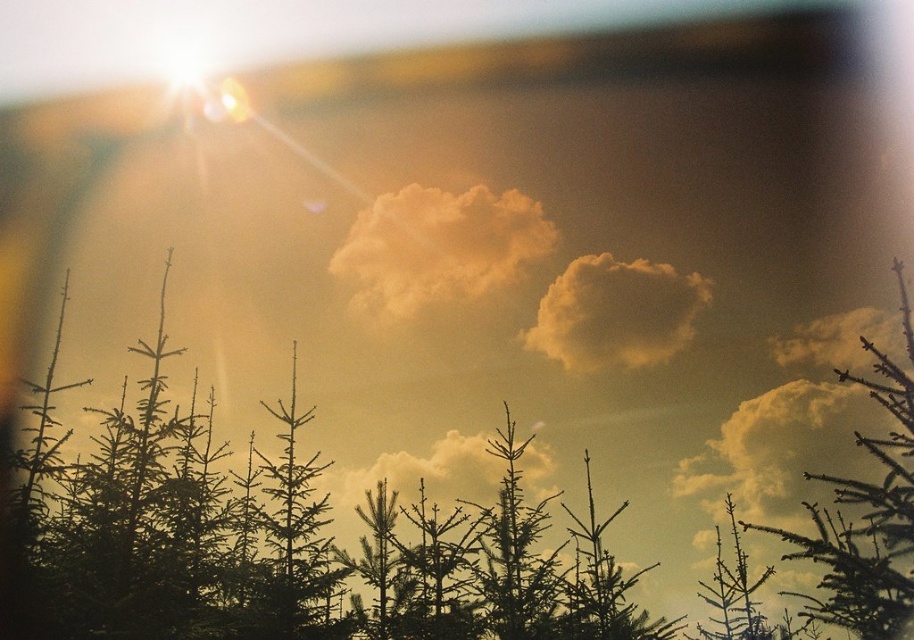
Question: Which of these objects is positioned farthest from the cloudy at center?

Choices:
 (A) fuzzy yellow cloud at upper center
 (B) soft yellow cloud at upper center
 (C) fuzzy golden cloud at upper center
 (D) silvery metallic pine tree at upper right

Answer: (D)

Question: Which point is farther to the camera?

Choices:
 (A) cloudy at center
 (B) fuzzy golden cloud at upper center
 (C) fuzzy yellow cloud at upper center
 (D) soft yellow cloud at upper center

Answer: (B)

Question: Considering the relative positions of silvery metallic pine tree at upper right and cloudy at center in the image provided, where is silvery metallic pine tree at upper right located with respect to cloudy at center?

Choices:
 (A) left
 (B) right

Answer: (B)

Question: Observing the image, what is the correct spatial positioning of fuzzy yellow cloud at upper center in reference to fuzzy golden cloud at upper center?

Choices:
 (A) below
 (B) above

Answer: (A)

Question: Can you confirm if soft yellow cloud at upper center is positioned below silvery metallic pine tree at upper right?

Choices:
 (A) yes
 (B) no

Answer: (B)

Question: Which of the following is the farthest from the observer?

Choices:
 (A) (857, 323)
 (B) (583, 288)
 (C) (527, 461)
 (D) (457, 296)

Answer: (D)